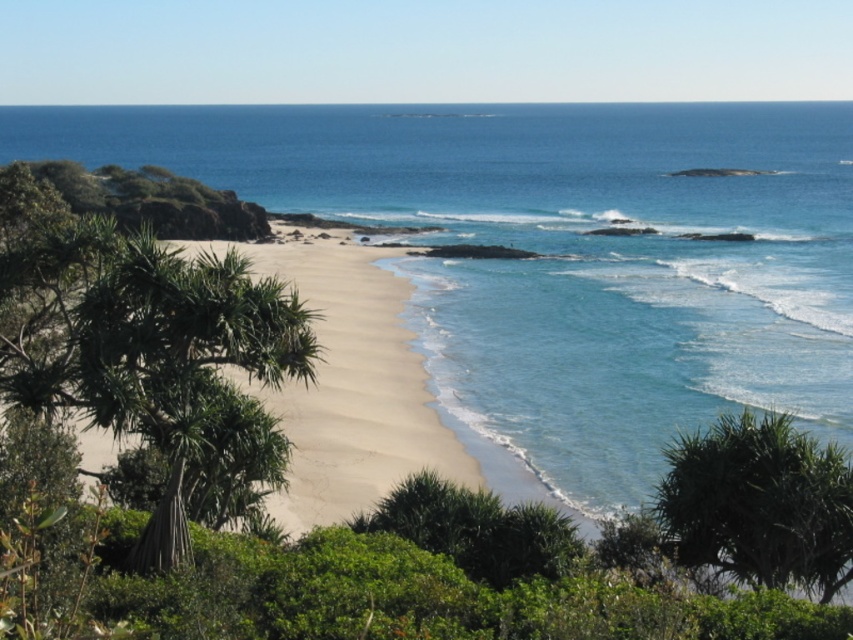
Is point (456, 260) more distant than point (379, 380)?

Yes, point (456, 260) is behind point (379, 380).

Does blue clear water at center have a greater height compared to light beige sand at center?

Yes.

Between point (633, 113) and point (83, 442), which one is positioned in front?

Positioned in front is point (83, 442).

At what (x,y) coordinates should I click in order to perform the action: click on blue clear water at center. Please return your answer as a coordinate pair (x, y). Looking at the image, I should click on (558, 259).